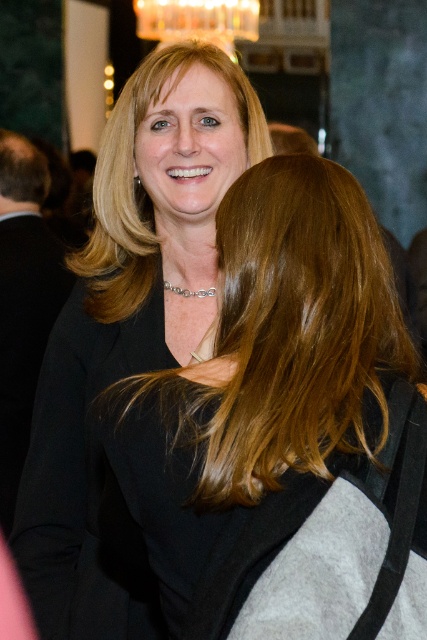
Question: Can you confirm if blonde hair at center is positioned to the left of blonde smooth hair at upper center?

Choices:
 (A) no
 (B) yes

Answer: (A)

Question: Does blonde hair at center have a smaller size compared to blonde smooth hair at upper center?

Choices:
 (A) yes
 (B) no

Answer: (A)

Question: Where is blonde hair at center located in relation to blonde smooth hair at upper center in the image?

Choices:
 (A) below
 (B) above

Answer: (A)

Question: Which of the following is the farthest from the observer?

Choices:
 (A) blonde hair at center
 (B) blonde smooth hair at upper center

Answer: (B)